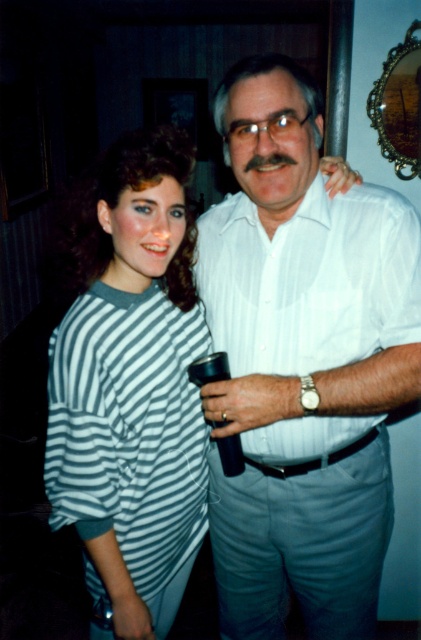
Question: Is striped fabric shirt at center positioned at the back of white striped shirt at center?

Choices:
 (A) no
 (B) yes

Answer: (A)

Question: Is the position of striped fabric shirt at center more distant than that of white striped shirt at center?

Choices:
 (A) no
 (B) yes

Answer: (A)

Question: Among these points, which one is farthest from the camera?

Choices:
 (A) (173, 168)
 (B) (298, 212)

Answer: (B)

Question: Which object appears closest to the camera in this image?

Choices:
 (A) white striped shirt at center
 (B) striped fabric shirt at center

Answer: (B)

Question: Which of the following is the farthest from the observer?

Choices:
 (A) (202, 214)
 (B) (95, 355)

Answer: (A)

Question: Is striped fabric shirt at center closer to camera compared to white striped shirt at center?

Choices:
 (A) no
 (B) yes

Answer: (B)